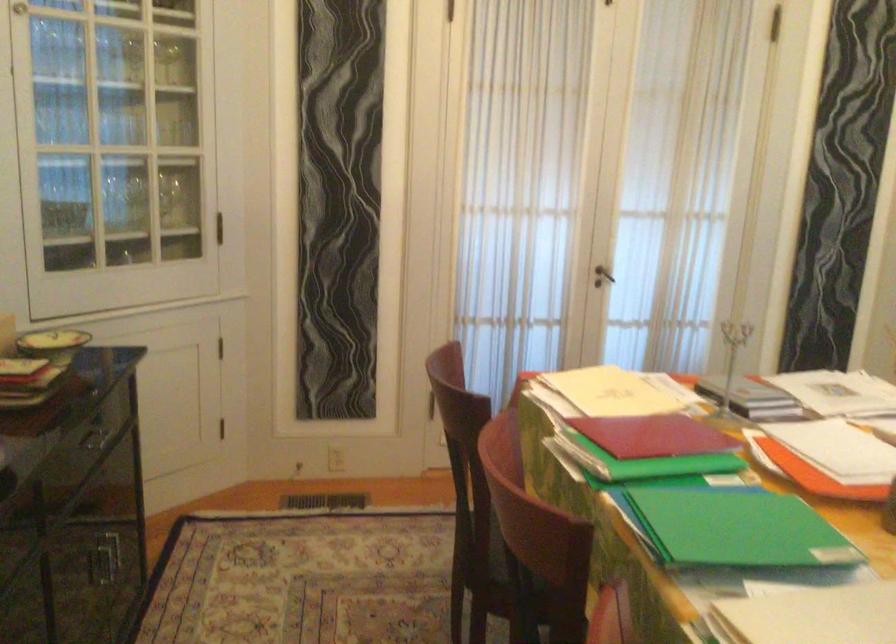
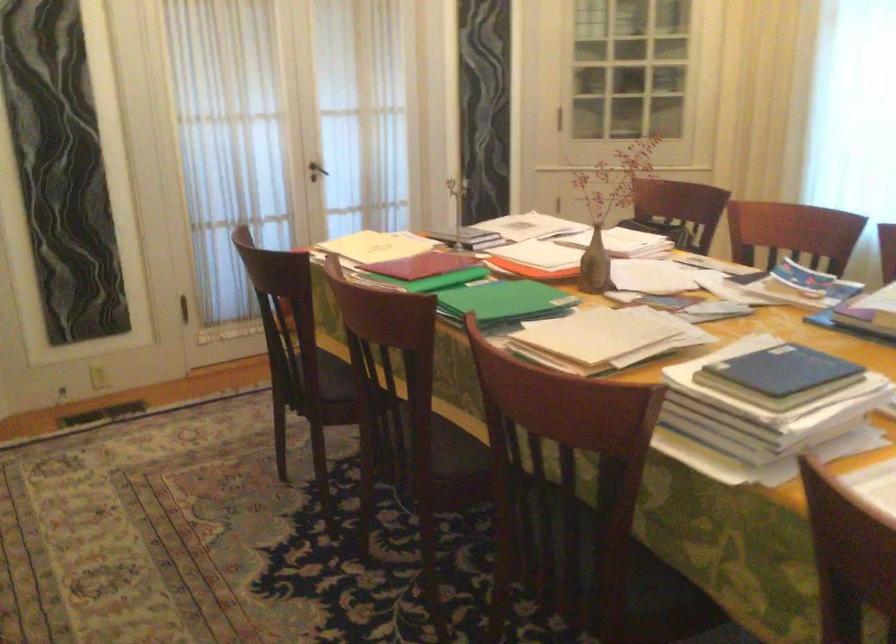
Where in the second image is the point corresponding to the point at 728,529 from the first image?

(504, 301)